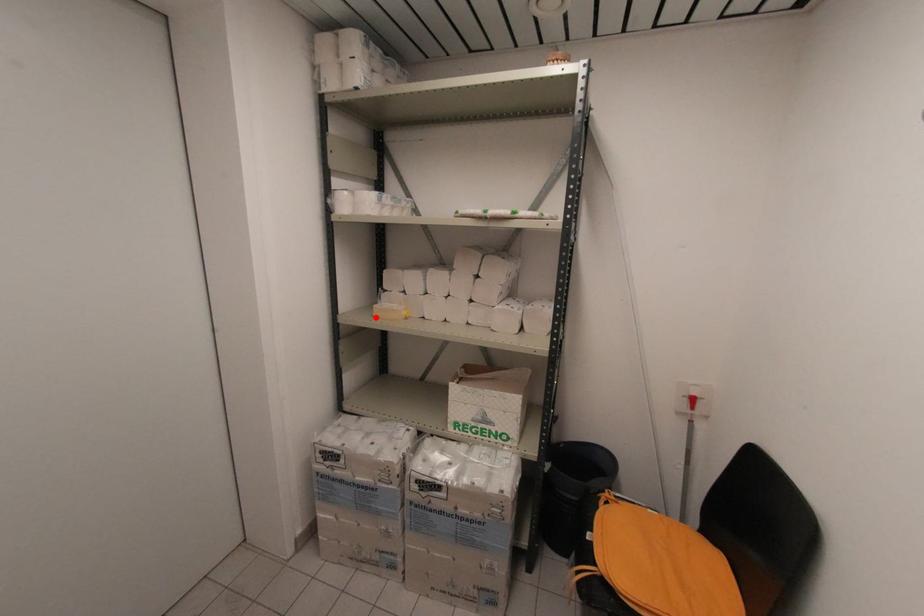
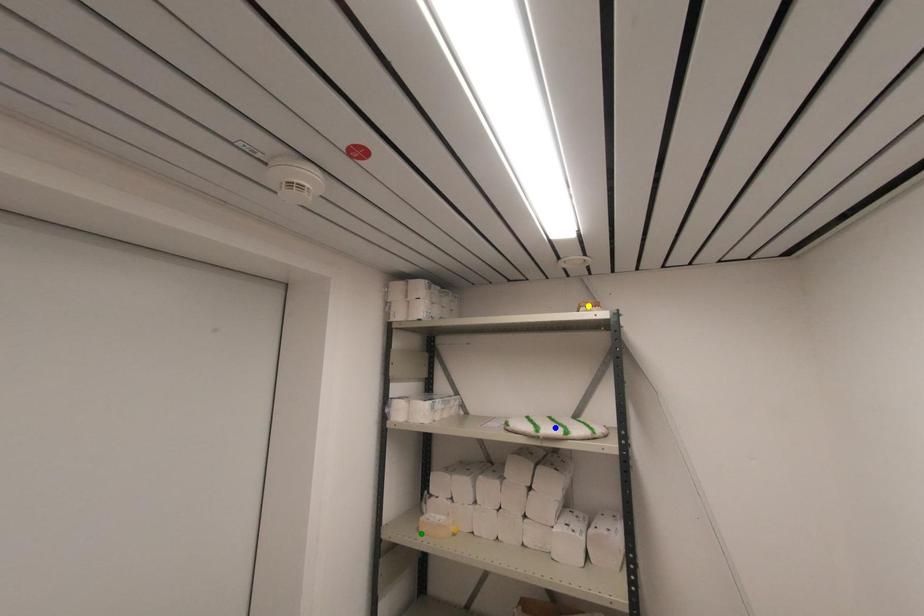
Question: I am providing you with two images of the same scene from different viewpoints. A red point is marked on the first image. You are given multiple points on the second image. In image 2, which mark is for the same physical point as the one in image 1?

Choices:
 (A) blue point
 (B) yellow point
 (C) green point

Answer: (C)